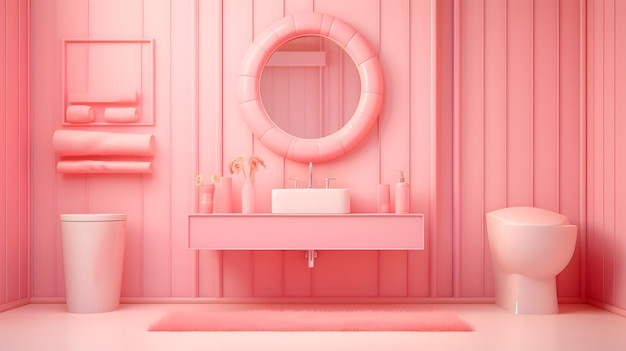
Identify the location of pink wall. (467, 150), (203, 134).